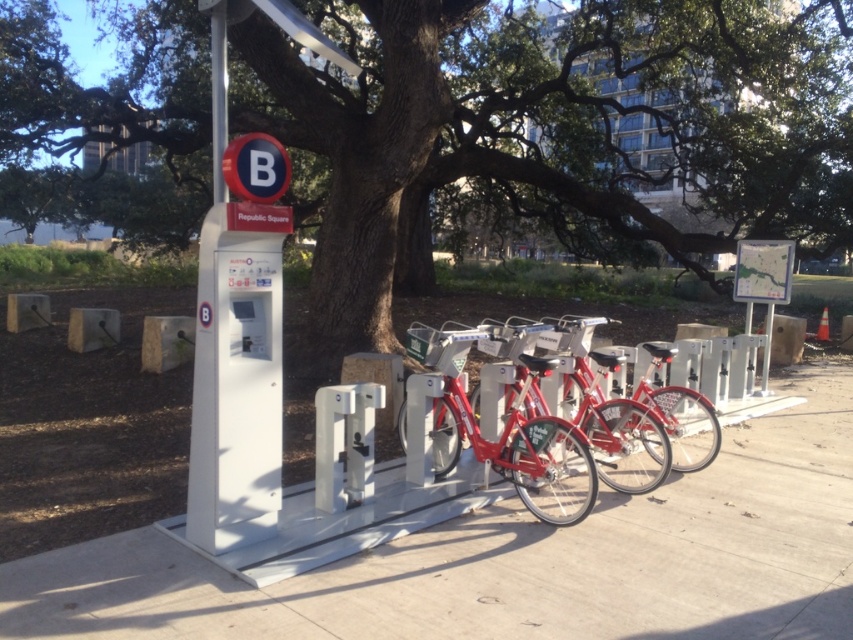
Question: Which point appears farthest from the camera in this image?

Choices:
 (A) [x=601, y=440]
 (B) [x=218, y=61]

Answer: (A)

Question: Does green leafy tree at center appear under shiny metallic bicycle at center?

Choices:
 (A) no
 (B) yes

Answer: (A)

Question: Which point is closer to the camera?

Choices:
 (A) shiny metallic bicycle at center
 (B) green leafy tree at center

Answer: (B)

Question: Does green leafy tree at center appear under metallic circular sign at upper center?

Choices:
 (A) yes
 (B) no

Answer: (B)

Question: Is green leafy tree at center smaller than metallic red bike at center?

Choices:
 (A) no
 (B) yes

Answer: (A)

Question: Which of the following is the farthest from the observer?

Choices:
 (A) green leafy tree at center
 (B) metallic circular sign at upper center
 (C) metallic pole at upper center
 (D) shiny metallic bicycle at center

Answer: (D)